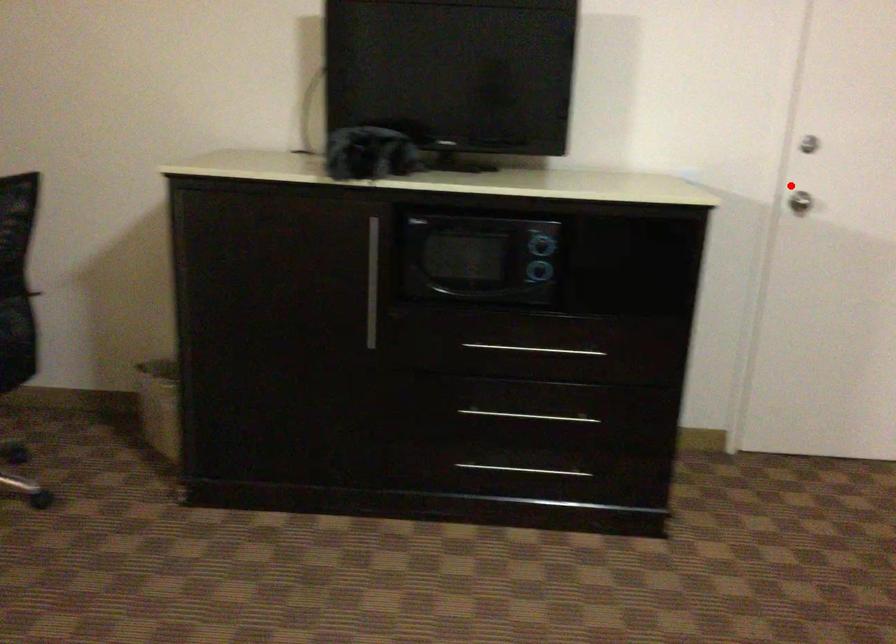
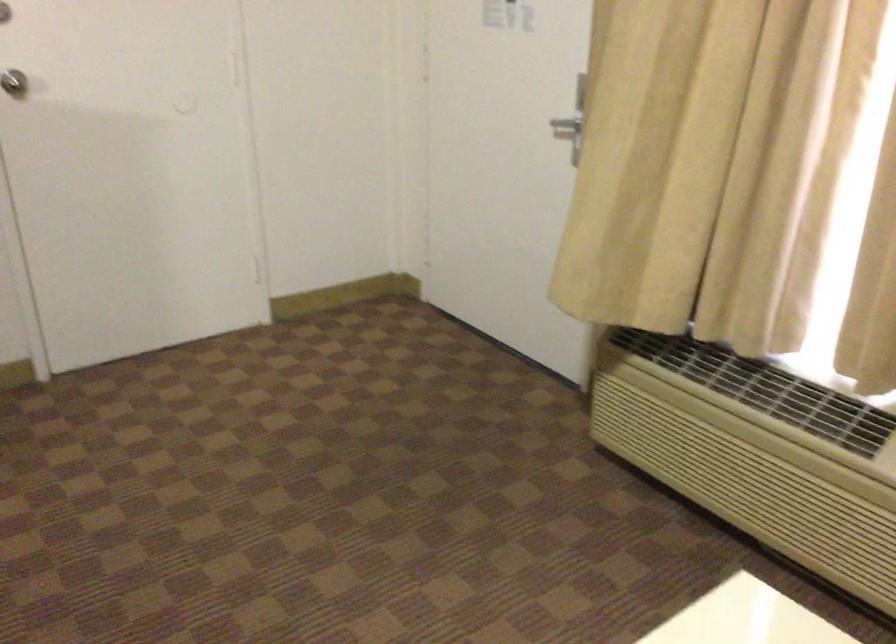
Where in the second image is the point corresponding to the highlighted location from the first image?

(13, 82)